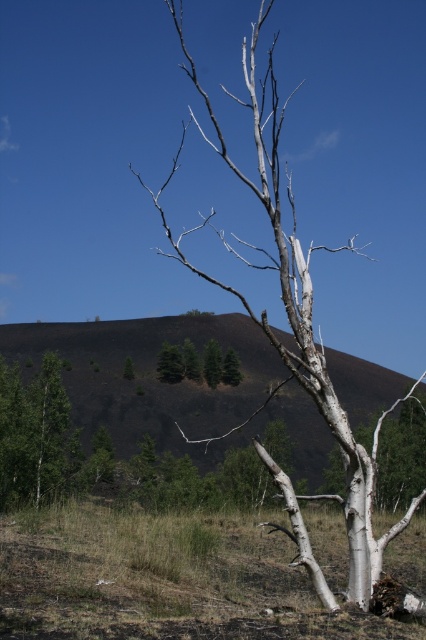
You are standing at the point with coordinates point (187, 358) and want to walk to the point with coordinates point (331, 408). Which direction should you move to reach your destination?

To reach point (331, 408) from point (187, 358), you should move forward since point (331, 408) is in front of point (187, 358).

You are a park ranger assessing the damage from a recent wildfire. You need to determine if a new sapling can be planted between the burnt soil at center and the white bark birch tree at center. The sapling requires a minimum of 20 meters of space to grow properly. Based on the image, is there sufficient space?

The distance between the burnt soil at center and the white bark birch tree at center is 19.64 meters. Since the sapling requires a minimum of 20 meters, there is insufficient space to plant it there.